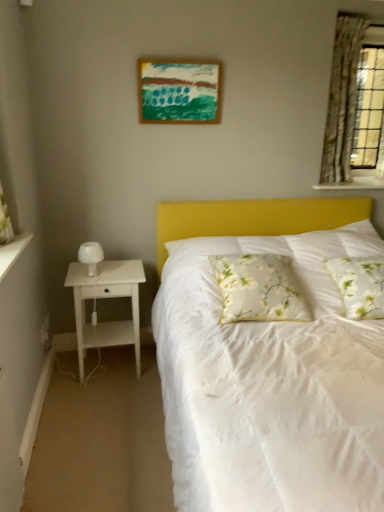
Question: Considering the positions of white floral fabric pillow at center, the 2th pillow when ordered from left to right, and white textured shelf at upper right in the image, is white floral fabric pillow at center, the 2th pillow when ordered from left to right, bigger or smaller than white textured shelf at upper right?

Choices:
 (A) small
 (B) big

Answer: (B)

Question: Is white floral fabric pillow at center, which is counted as the first pillow, starting from the right, inside or outside of white textured shelf at upper right?

Choices:
 (A) inside
 (B) outside

Answer: (B)

Question: Estimate the real-world distances between objects in this image. Which object is farther from the white wood nightstand at left?

Choices:
 (A) green floral fabric curtain at upper right
 (B) white textured shelf at upper right
 (C) white matte table lamp at left
 (D) white floral fabric pillow at center, the 2th pillow when ordered from left to right
 (E) acrylic painting at upper center

Answer: (A)

Question: Which of these objects is positioned farthest from the acrylic painting at upper center?

Choices:
 (A) white floral fabric pillow at center, the 2th pillow when ordered from left to right
 (B) white wood nightstand at left
 (C) green floral fabric curtain at upper right
 (D) white textured shelf at upper right
 (E) white matte table lamp at left

Answer: (A)